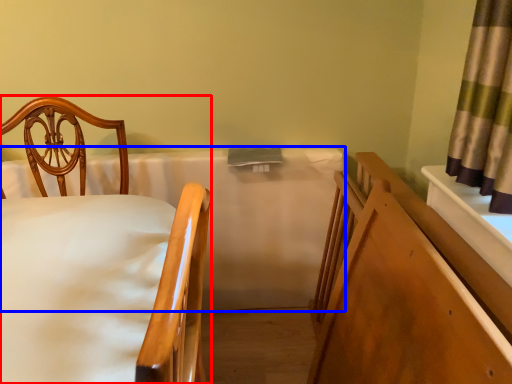
Question: Among these objects, which one is farthest to the camera, chair (highlighted by a red box) or mattress (highlighted by a blue box)?

Choices:
 (A) chair
 (B) mattress

Answer: (B)